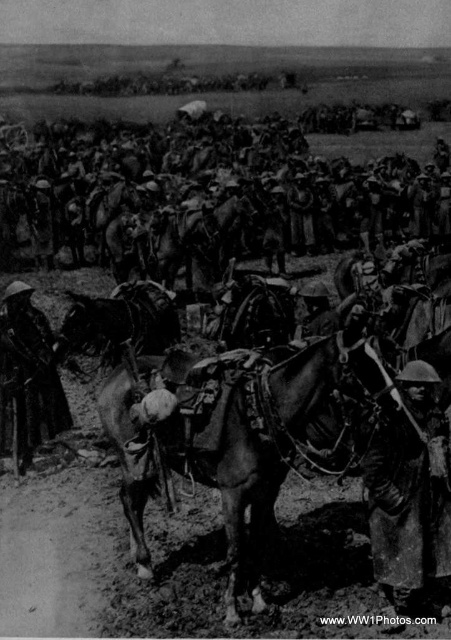
Question: Considering the relative positions of rusty metal rifle at lower right and dark brown leather hat at center in the image provided, where is rusty metal rifle at lower right located with respect to dark brown leather hat at center?

Choices:
 (A) below
 (B) above

Answer: (A)

Question: Which point appears closest to the camera in this image?

Choices:
 (A) (265, 451)
 (B) (374, 570)
 (C) (32, 321)

Answer: (A)

Question: Is rusty metal rifle at lower right wider than dark brown leather hat at center?

Choices:
 (A) no
 (B) yes

Answer: (A)

Question: Is dark brown leather horse at center wider than rusty metal rifle at lower right?

Choices:
 (A) yes
 (B) no

Answer: (A)

Question: Among these objects, which one is farthest from the camera?

Choices:
 (A) rusty metal rifle at lower right
 (B) dark brown leather horse at center
 (C) dark brown leather hat at center

Answer: (C)

Question: Among these objects, which one is nearest to the camera?

Choices:
 (A) dark brown leather horse at center
 (B) dark brown leather hat at center
 (C) rusty metal rifle at lower right

Answer: (A)